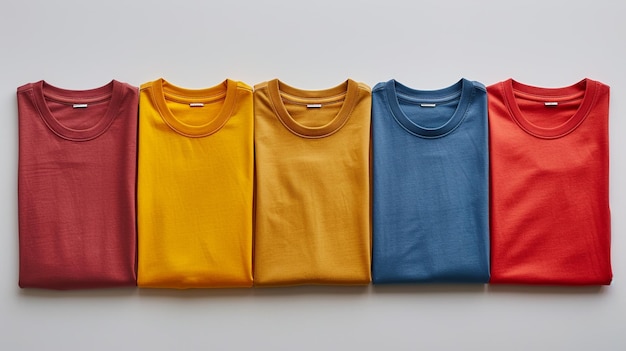
You are a GUI agent. You are given a task and a screenshot of the screen. Output one action in this format:
    pyautogui.click(x=<x>, y=<y>)
    Task: Click on the folded tshirts in various colors
    The image size is (626, 351).
    Given the screenshot: What is the action you would take?
    pyautogui.click(x=64, y=241), pyautogui.click(x=183, y=231), pyautogui.click(x=315, y=225), pyautogui.click(x=452, y=221), pyautogui.click(x=520, y=219)